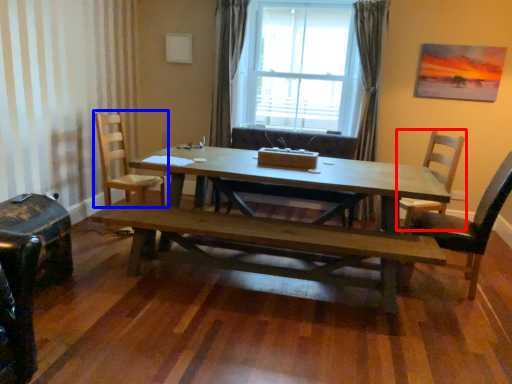
Question: Which point is closer to the camera, chair (highlighted by a red box) or chair (highlighted by a blue box)?

Choices:
 (A) chair
 (B) chair

Answer: (A)